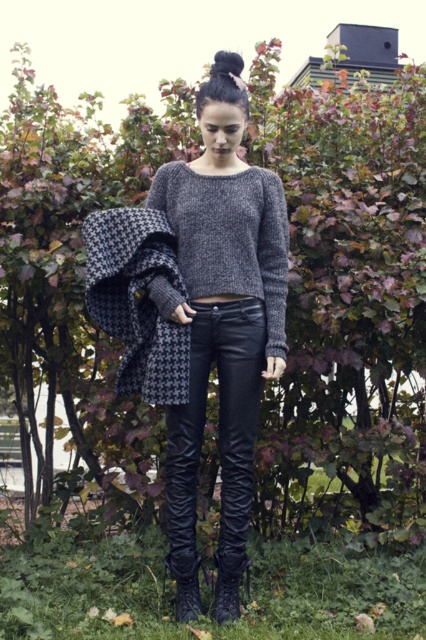
Question: Which of these objects is positioned farthest from the knitted gray sweater at center?

Choices:
 (A) houndstooth wool shawl at left
 (B) knit sweater at center

Answer: (A)

Question: From the image, what is the correct spatial relationship of knitted gray sweater at center in relation to houndstooth wool shawl at left?

Choices:
 (A) below
 (B) above

Answer: (B)

Question: From the image, what is the correct spatial relationship of knit sweater at center in relation to knitted gray sweater at center?

Choices:
 (A) above
 (B) below

Answer: (B)

Question: Which point is farther from the camera taking this photo?

Choices:
 (A) (264, 228)
 (B) (224, 445)

Answer: (A)

Question: Can you confirm if knitted gray sweater at center is bigger than houndstooth wool shawl at left?

Choices:
 (A) no
 (B) yes

Answer: (B)

Question: Which object is the farthest from the houndstooth wool shawl at left?

Choices:
 (A) knit sweater at center
 (B) knitted gray sweater at center

Answer: (A)